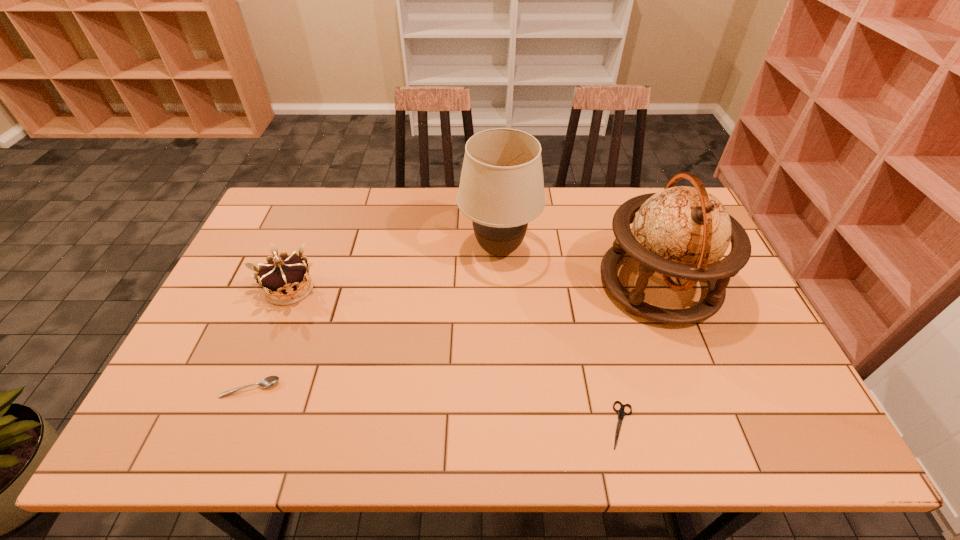
This screenshot has width=960, height=540. Identify the location of free region located on the back of the soupspoon. (282, 308).

Identify the location of vacant region located 0.300m on the back of the second object from right to left. (593, 303).

Identify the location of object positioned at the far edge. (501, 190).

Find the location of a particular element. The width and height of the screenshot is (960, 540). object that is at the near edge is located at coordinates (621, 413).

At what (x,y) coordinates should I click in order to perform the action: click on crown at the left edge. Please return your answer as a coordinate pair (x, y). Image resolution: width=960 pixels, height=540 pixels. Looking at the image, I should click on [285, 279].

At what (x,y) coordinates should I click in order to perform the action: click on soupspoon that is positioned at the left edge. Please return your answer as a coordinate pair (x, y). Looking at the image, I should click on (269, 381).

Identify the location of object that is positioned at the right edge. The width and height of the screenshot is (960, 540). (683, 232).

Locate an element on the screen. This screenshot has height=540, width=960. vacant space at the far edge of the desktop is located at coordinates (614, 202).

In order to click on free space at the near edge of the desktop in this screenshot , I will do (x=440, y=414).

You are a GUI agent. You are given a task and a screenshot of the screen. Output one action in this format:
    pyautogui.click(x=<x>, y=<y>)
    Task: Click on the free space at the left edge
    
    Given the screenshot: What is the action you would take?
    pyautogui.click(x=234, y=400)